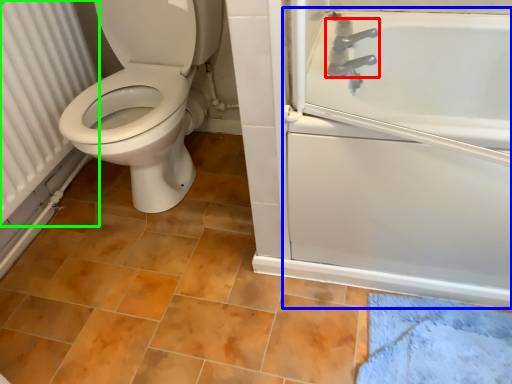
Question: Which is farther away from tap (highlighted by a red box)? bath (highlighted by a blue box) or radiator (highlighted by a green box)?

Choices:
 (A) bath
 (B) radiator

Answer: (B)